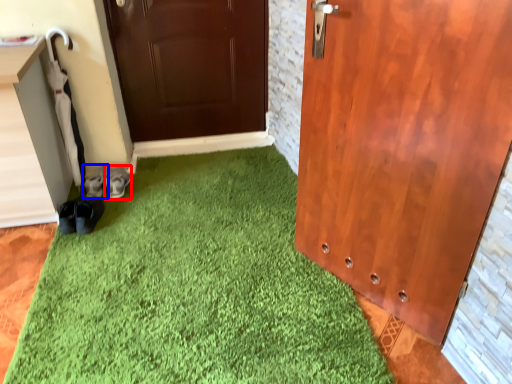
Question: Which point is further to the camera, footwear (highlighted by a red box) or footwear (highlighted by a blue box)?

Choices:
 (A) footwear
 (B) footwear

Answer: (B)